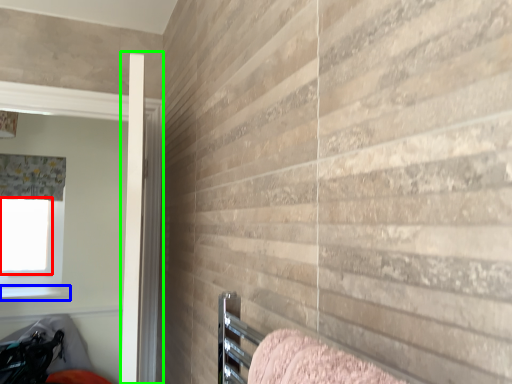
Question: Which object is positioned farthest from window screen (highlighted by a red box)? Select from window sill (highlighted by a blue box) and screen door (highlighted by a green box).

Choices:
 (A) window sill
 (B) screen door

Answer: (B)